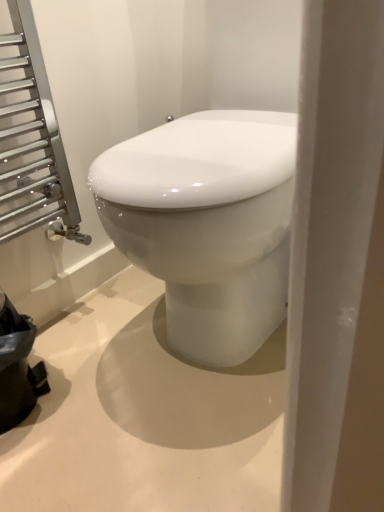
Image resolution: width=384 pixels, height=512 pixels. What do you see at coordinates (31, 139) in the screenshot?
I see `transparent glass towel rack at upper left` at bounding box center [31, 139].

Looking at this image, measure the distance between point [22,164] and camera.

A distance of 38.07 inches exists between point [22,164] and camera.

Where is `transparent glass towel rack at upper left`? The height and width of the screenshot is (512, 384). transparent glass towel rack at upper left is located at coordinates (31, 139).

Where is `transparent glass towel rack at upper left`? transparent glass towel rack at upper left is located at coordinates (31, 139).